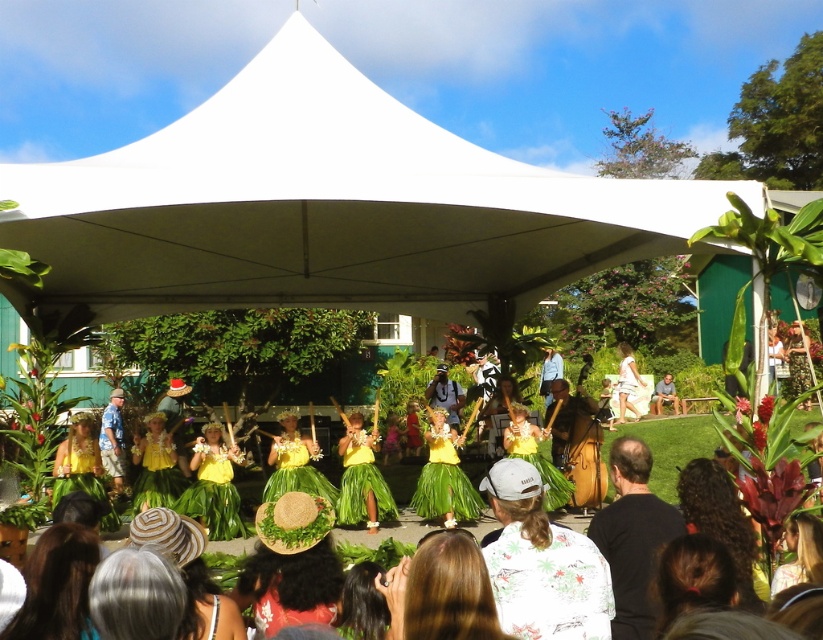
You are a photographer standing at the front of the tent where the cultural performance is happening. You want to take a photo that includes both the point at coordinates point (101, 428) and point (673, 403). Which point should you focus on first to ensure both are in sharp focus?

You should focus on point (101, 428) first because it is closer to you than point (673, 403). This ensures that both points will be within the depth of field and in sharp focus.

You are a photographer at the back of the audience, and you want to take a photo of the white cotton dress at center without the white fabric canopy at center blocking it. Is this possible?

The white fabric canopy at center is in front of the white cotton dress at center, so it will block the view. Move to a position where the canopy is not between you and the dress.